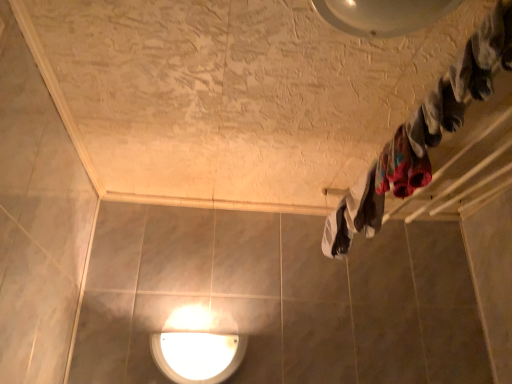
Question: Is white fabric at center, which ranks as the 2th clothing in front-to-back order, further to camera compared to multicolored fabric at upper right, which appears as the first clothing when viewed from the front?

Choices:
 (A) yes
 (B) no

Answer: (A)

Question: Would you say multicolored fabric at upper right, the 2th clothing viewed from the back, is part of white fabric at center, which ranks as the 2th clothing in front-to-back order,'s contents?

Choices:
 (A) yes
 (B) no

Answer: (B)

Question: From the image's perspective, is white fabric at center, the 1th clothing positioned from the back, beneath multicolored fabric at upper right, the 2th clothing viewed from the back?

Choices:
 (A) no
 (B) yes

Answer: (B)

Question: Is white fabric at center, which ranks as the 2th clothing in front-to-back order, bigger than multicolored fabric at upper right, the 2th clothing viewed from the back?

Choices:
 (A) yes
 (B) no

Answer: (A)

Question: From the image's perspective, is white fabric at center, which ranks as the 2th clothing in front-to-back order, on top of multicolored fabric at upper right, which appears as the first clothing when viewed from the front?

Choices:
 (A) no
 (B) yes

Answer: (A)

Question: Is white fabric at center, the 1th clothing positioned from the back, far away from multicolored fabric at upper right, the 2th clothing viewed from the back?

Choices:
 (A) no
 (B) yes

Answer: (A)

Question: Is white glossy light fixture at center not inside white fabric at center, which ranks as the 2th clothing in front-to-back order?

Choices:
 (A) yes
 (B) no

Answer: (A)

Question: Does white glossy light fixture at center have a lesser height compared to white fabric at center, which ranks as the 2th clothing in front-to-back order?

Choices:
 (A) no
 (B) yes

Answer: (A)

Question: Are white glossy light fixture at center and white fabric at center, which ranks as the 2th clothing in front-to-back order, beside each other?

Choices:
 (A) yes
 (B) no

Answer: (B)

Question: Can you confirm if white glossy light fixture at center is bigger than white fabric at center, the 1th clothing positioned from the back?

Choices:
 (A) no
 (B) yes

Answer: (A)

Question: Considering the relative positions of white glossy light fixture at center and white fabric at center, the 1th clothing positioned from the back, in the image provided, is white glossy light fixture at center behind white fabric at center, the 1th clothing positioned from the back,?

Choices:
 (A) no
 (B) yes

Answer: (B)

Question: Is white glossy light fixture at center positioned before white fabric at center, which ranks as the 2th clothing in front-to-back order?

Choices:
 (A) yes
 (B) no

Answer: (B)

Question: From a real-world perspective, is white fabric at center, which ranks as the 2th clothing in front-to-back order, over white glossy light fixture at center?

Choices:
 (A) yes
 (B) no

Answer: (A)